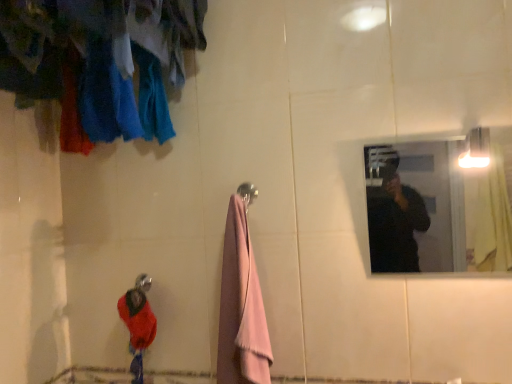
Question: From the image's perspective, is brushed metal shower head at lower left located above or below velvet red sweater at lower left?

Choices:
 (A) below
 (B) above

Answer: (B)

Question: Is brushed metal shower head at lower left bigger or smaller than velvet red sweater at lower left?

Choices:
 (A) small
 (B) big

Answer: (A)

Question: Which of these objects is positioned farthest from the brushed metal shower head at lower left?

Choices:
 (A) velvet red sweater at lower left
 (B) metallic reflective mirror at upper right
 (C) pink fluffy towel at center

Answer: (B)

Question: Which object is positioned closest to the pink fluffy towel at center?

Choices:
 (A) velvet red sweater at lower left
 (B) metallic reflective mirror at upper right
 (C) brushed metal shower head at lower left

Answer: (A)